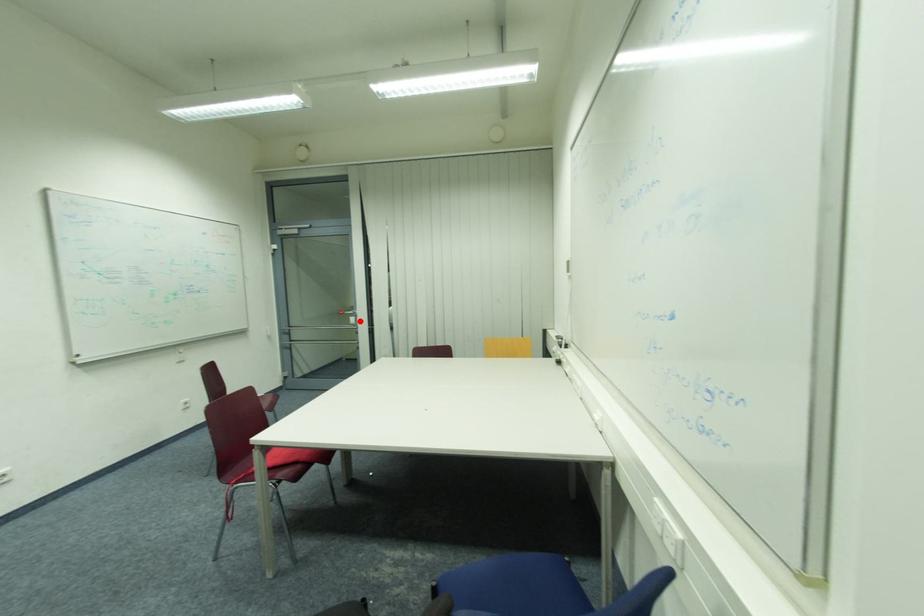
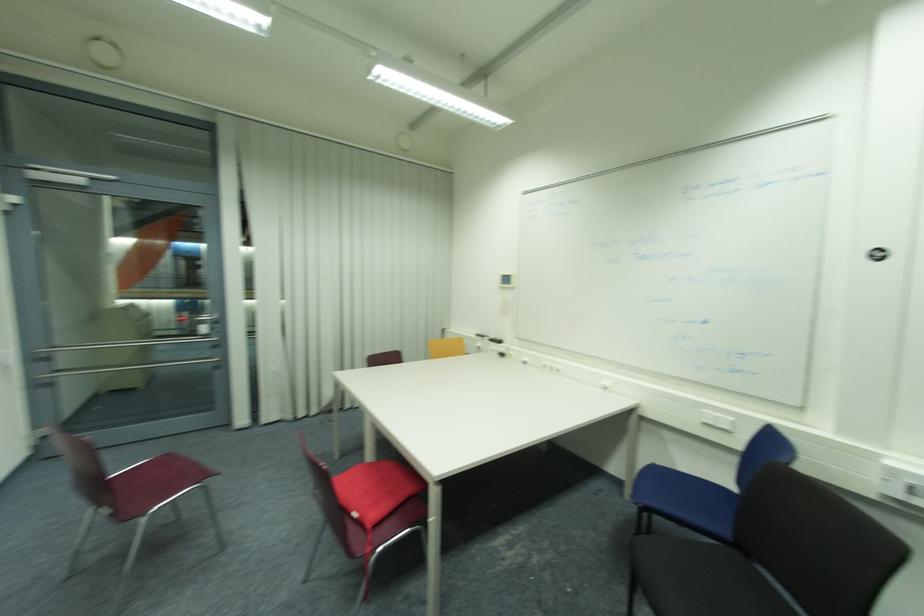
In the second image, find the point that corresponds to the highlighted location in the first image.

(217, 330)